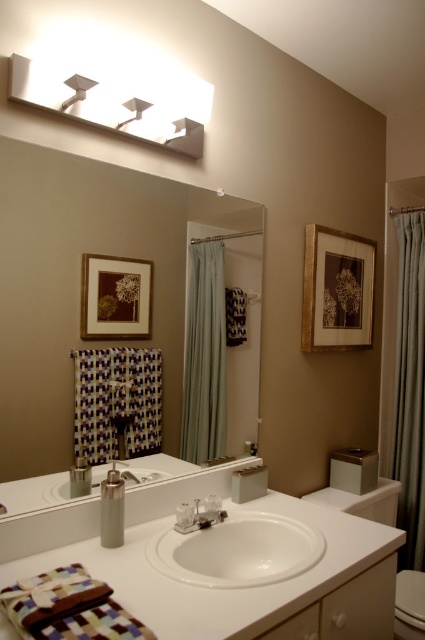
Can you confirm if clear glass mirror at center is positioned to the left of white matte light fixture at upper center?

Incorrect, clear glass mirror at center is not on the left side of white matte light fixture at upper center.

Is clear glass mirror at center thinner than white matte light fixture at upper center?

No, clear glass mirror at center is not thinner than white matte light fixture at upper center.

Who is more forward, [48,394] or [85,90]?

Point [48,394]

Locate an element on the screen. This screenshot has width=425, height=640. clear glass mirror at center is located at coordinates (79, 284).

Can you confirm if white matte light fixture at upper center is thinner than matte gray curtain at right?

Incorrect, white matte light fixture at upper center's width is not less than matte gray curtain at right's.

Looking at this image, can you confirm if white matte light fixture at upper center is bigger than matte gray curtain at right?

Incorrect, white matte light fixture at upper center is not larger than matte gray curtain at right.

Locate an element on the screen. white matte light fixture at upper center is located at coordinates 113,106.

Identify the location of white matte light fixture at upper center. The image size is (425, 640). (113, 106).

Is point (161, 122) less distant than point (176, 579)?

No.

Which is in front, point (25, 56) or point (234, 532)?

Point (25, 56)

At what (x,y) coordinates should I click in order to perform the action: click on white matte light fixture at upper center. Please return your answer as a coordinate pair (x, y). Looking at the image, I should click on (113, 106).